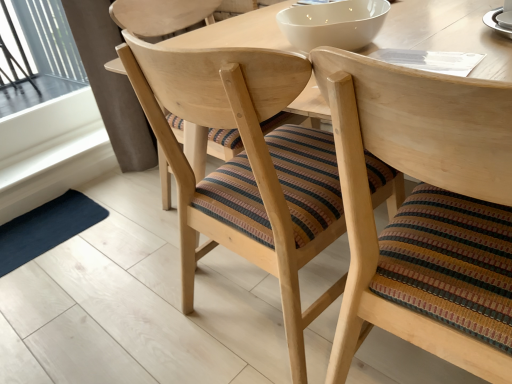
Question: Considering the positions of white glossy saucer at upper right and white glossy bowl at upper center in the image, is white glossy saucer at upper right taller or shorter than white glossy bowl at upper center?

Choices:
 (A) short
 (B) tall

Answer: (A)

Question: Is white glossy saucer at upper right bigger or smaller than white glossy bowl at upper center?

Choices:
 (A) big
 (B) small

Answer: (B)

Question: Considering the real-world distances, which object is farthest from the white glossy saucer at upper right?

Choices:
 (A) white glossy bowl at upper center
 (B) wooden chair with striped cushion at center, arranged as the first chair when viewed from the left
 (C) wooden chair with striped cushion at center, the first chair from the right
 (D) dark blue fabric mat at lower left

Answer: (D)

Question: Which is farther from the white glossy bowl at upper center?

Choices:
 (A) dark blue fabric mat at lower left
 (B) wooden chair with striped cushion at center, arranged as the first chair when viewed from the left
 (C) white glossy saucer at upper right
 (D) wooden chair with striped cushion at center, the second chair viewed from the left

Answer: (A)